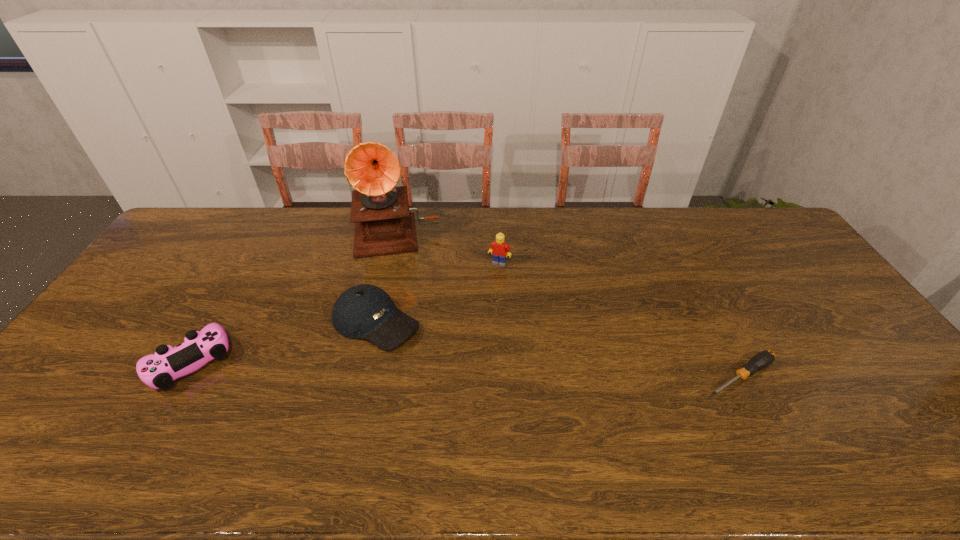
Locate an element on the screen. The image size is (960, 540). the leftmost object is located at coordinates (159, 370).

What are the coordinates of `screwdriver` in the screenshot? It's located at (761, 360).

The height and width of the screenshot is (540, 960). What are the coordinates of `the shortest object` in the screenshot? It's located at (761, 360).

You are a GUI agent. You are given a task and a screenshot of the screen. Output one action in this format:
    pyautogui.click(x=<x>, y=<y>)
    Task: Click on the fourth object from left to right
    The width and height of the screenshot is (960, 540).
    Given the screenshot: What is the action you would take?
    pyautogui.click(x=499, y=248)

Image resolution: width=960 pixels, height=540 pixels. Identify the location of Lego. (499, 248).

The height and width of the screenshot is (540, 960). I want to click on phonograph record, so click(383, 224).

Image resolution: width=960 pixels, height=540 pixels. What are the coordinates of `the tallest object` in the screenshot? It's located at (383, 224).

Identify the location of baseball cap. The width and height of the screenshot is (960, 540). (364, 311).

Where is `free space located 0.380m on the back of the leftmost object`? This screenshot has width=960, height=540. free space located 0.380m on the back of the leftmost object is located at coordinates (257, 247).

At what (x,y) coordinates should I click in order to perform the action: click on vacant point located on the back of the shortest object. Please return your answer as a coordinate pair (x, y). The width and height of the screenshot is (960, 540). Looking at the image, I should click on (706, 310).